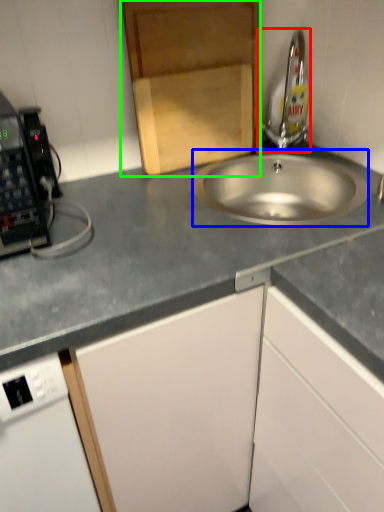
Question: Based on their relative distances, which object is farther from tap (highlighted by a red box)? Choose from sink (highlighted by a blue box) and cabinetry (highlighted by a green box).

Choices:
 (A) sink
 (B) cabinetry

Answer: (B)